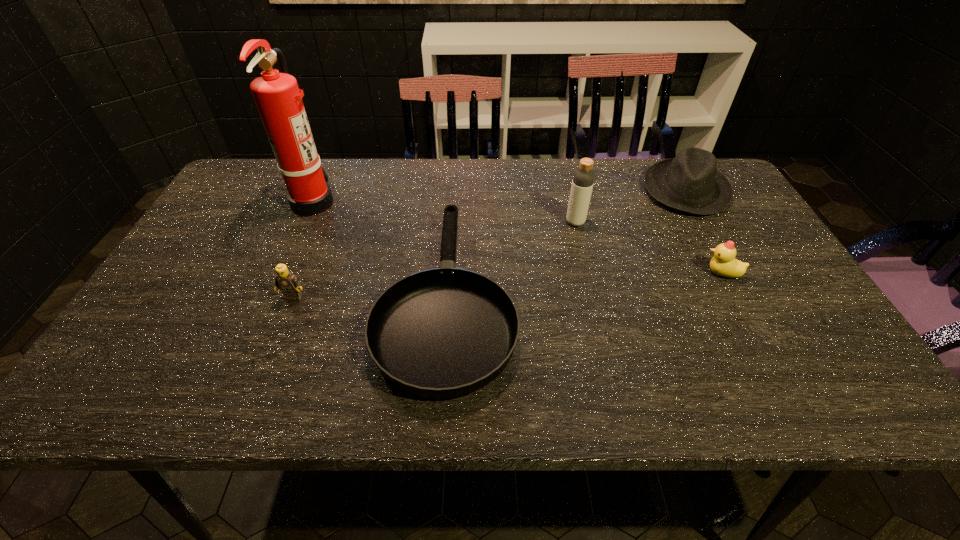
Where is `fire extinguisher`? This screenshot has height=540, width=960. fire extinguisher is located at coordinates point(278,98).

Find the location of a particular element. bottle is located at coordinates (583, 179).

Image resolution: width=960 pixels, height=540 pixels. Identify the location of the fifth shortest object. (583, 179).

I want to click on fedora, so click(x=690, y=182).

The height and width of the screenshot is (540, 960). I want to click on Lego, so click(288, 283).

Locate an element on the screen. The height and width of the screenshot is (540, 960). duckling is located at coordinates (723, 263).

Where is `the fourth object from right to left`? This screenshot has width=960, height=540. the fourth object from right to left is located at coordinates (445, 332).

Locate an element on the screen. the shortest object is located at coordinates (445, 332).

Identify the location of vacant area located 0.070m at the nozzle of the tallest object. (358, 201).

The image size is (960, 540). I want to click on free space located 0.390m on the front of the third object from right to left, so click(x=605, y=347).